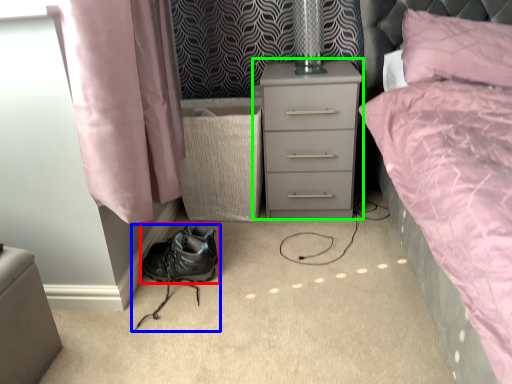
Question: Considering the real-world distances, which object is farthest from shoe (highlighted by a red box)? footwear (highlighted by a blue box) or nightstand (highlighted by a green box)?

Choices:
 (A) footwear
 (B) nightstand

Answer: (B)